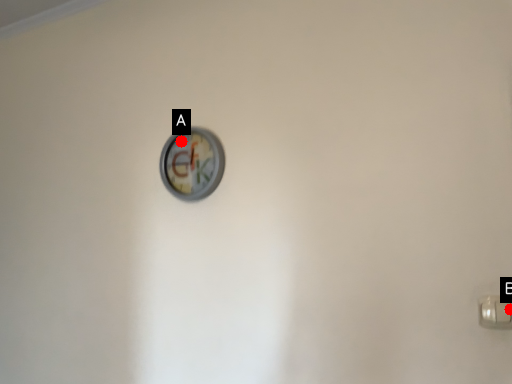
Question: Two points are circled on the image, labeled by A and B beside each circle. Among these points, which one is nearest to the camera?

Choices:
 (A) A is closer
 (B) B is closer

Answer: (B)